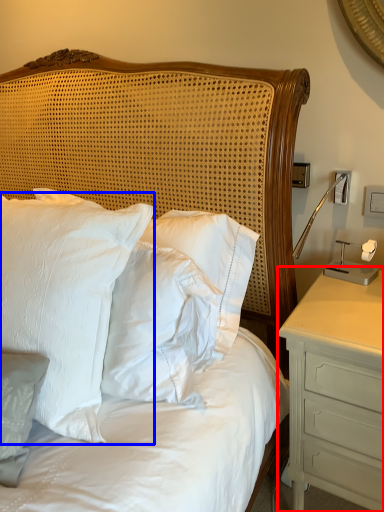
Question: Which object appears farthest to the camera in this image, nightstand (highlighted by a red box) or pillow (highlighted by a blue box)?

Choices:
 (A) nightstand
 (B) pillow

Answer: (A)